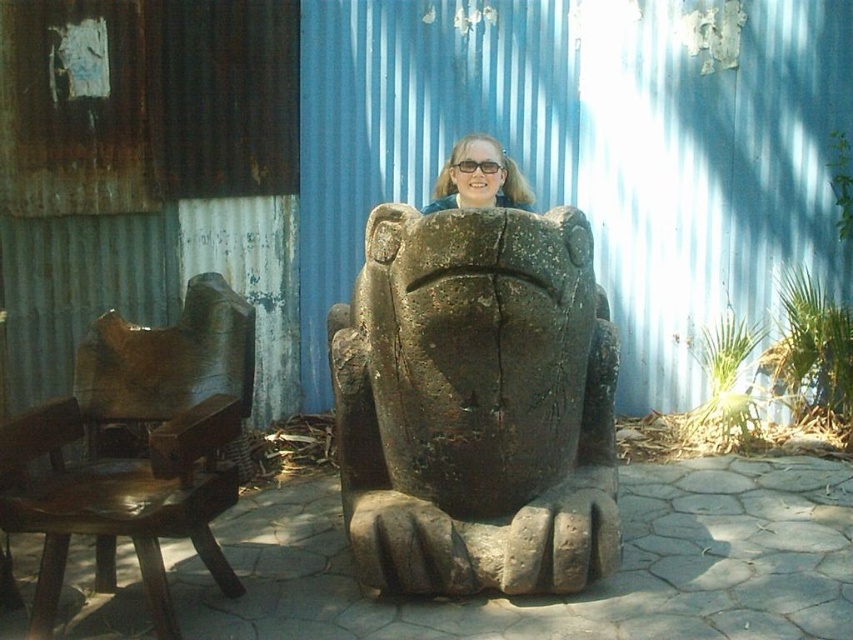
Measure the distance between point (192,476) and camera.

Point (192,476) and camera are 2.55 meters apart from each other.

Can you confirm if brown polished wood chair at left is wider than matte brown stone statue at center?

Correct, the width of brown polished wood chair at left exceeds that of matte brown stone statue at center.

At what (x,y) coordinates should I click in order to perform the action: click on brown polished wood chair at left. Please return your answer as a coordinate pair (x, y). This screenshot has width=853, height=640. Looking at the image, I should click on (146, 448).

Between point (573, 460) and point (27, 445), which one is positioned behind?

The point (573, 460) is more distant.

Consider the image. Who is shorter, dark brown stone statue at center or brown polished wood chair at left?

brown polished wood chair at left is shorter.

In order to click on dark brown stone statue at center in this screenshot , I will do `click(476, 392)`.

Find the location of a particular element. This screenshot has width=853, height=640. dark brown stone statue at center is located at coordinates (476, 392).

Does dark brown stone statue at center lie in front of matte brown stone statue at center?

Yes, it is.

Can you confirm if dark brown stone statue at center is wider than matte brown stone statue at center?

Yes.

Is point (396, 380) closer to camera compared to point (434, 180)?

That is True.

This screenshot has width=853, height=640. What are the coordinates of `dark brown stone statue at center` in the screenshot? It's located at (476, 392).